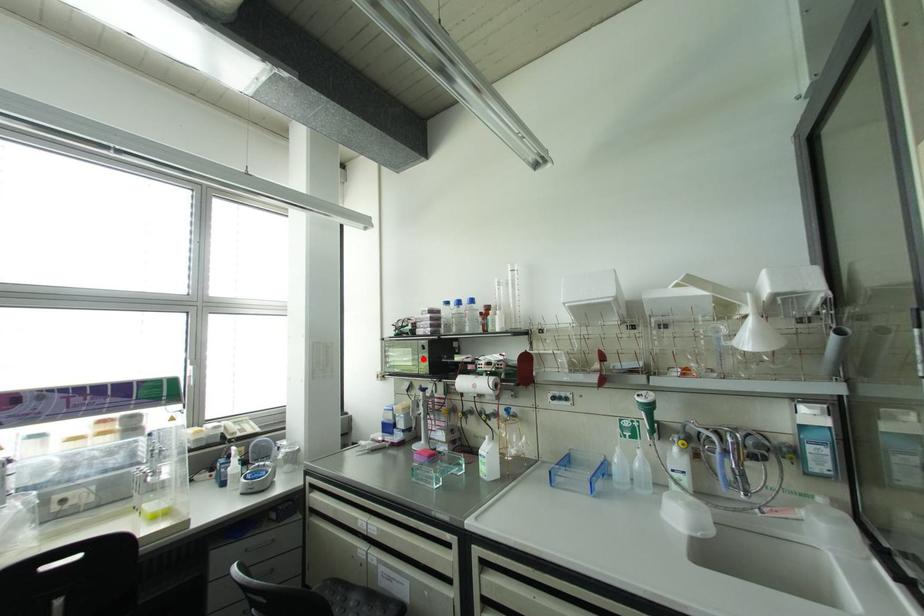
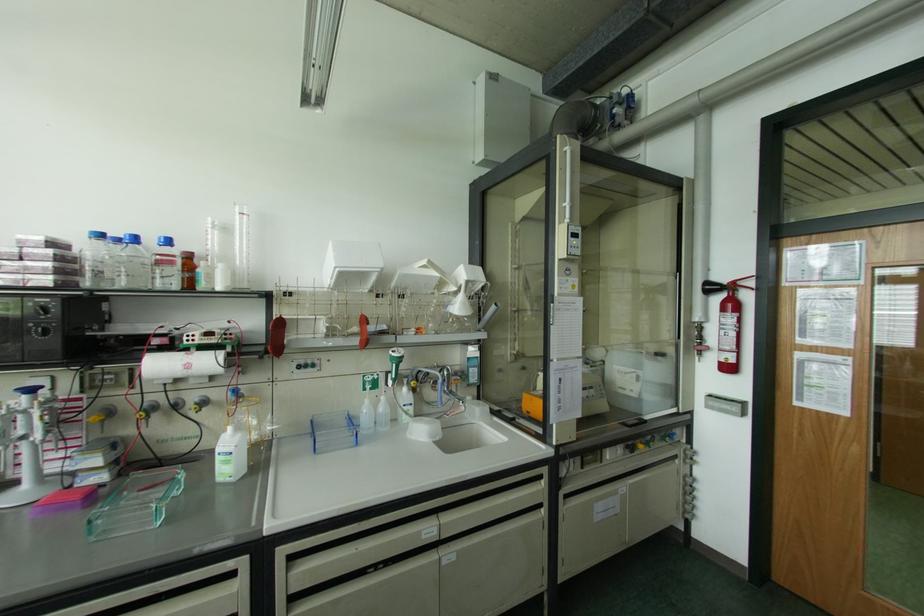
Locate, in the second image, the point that corresponds to the highlighted location in the first image.

(44, 333)